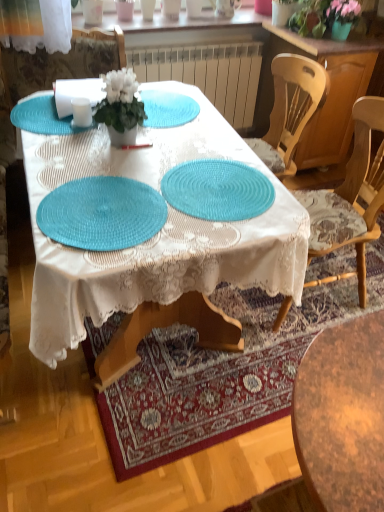
The height and width of the screenshot is (512, 384). Identify the location of empty space that is to the right of white matte pot at center. tap(174, 139).